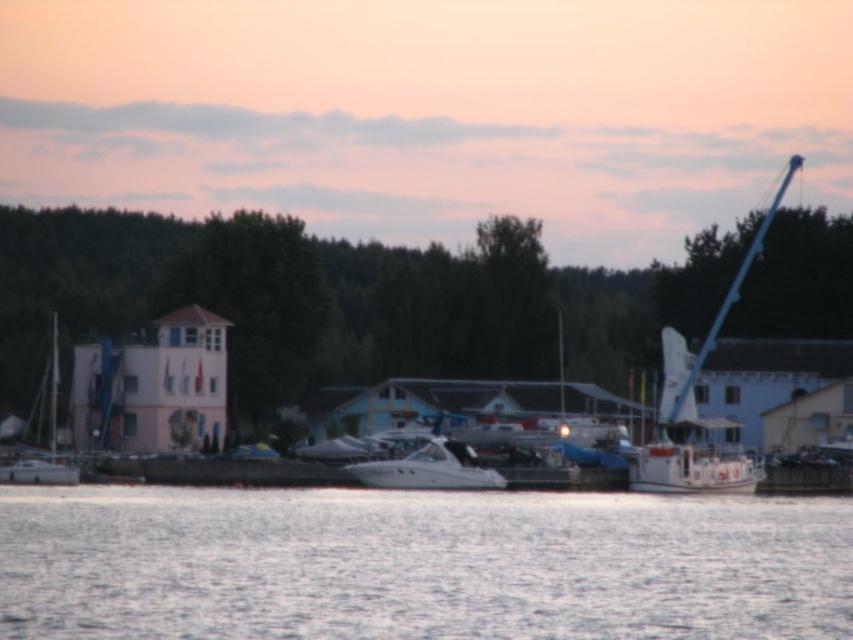
Question: Which object is farther from the camera taking this photo?

Choices:
 (A) clear water at center
 (B) white glossy sailboat at left

Answer: (B)

Question: Does white glossy boat at center appear on the left side of white glossy sailboat at left?

Choices:
 (A) yes
 (B) no

Answer: (B)

Question: Which point appears closest to the camera in this image?

Choices:
 (A) (277, 604)
 (B) (746, 476)

Answer: (A)

Question: Which point appears farthest from the camera in this image?

Choices:
 (A) (732, 284)
 (B) (421, 451)

Answer: (A)

Question: Does clear water at center appear on the right side of white glossy boat at center?

Choices:
 (A) yes
 (B) no

Answer: (B)

Question: Does clear water at center appear under white glossy boat at center?

Choices:
 (A) yes
 (B) no

Answer: (A)